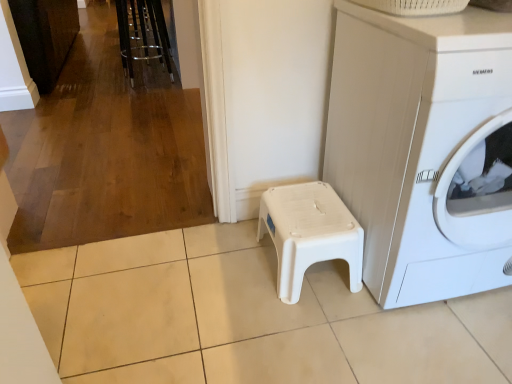
Question: In the image, is white plastic washing machine at lower right on the left side or the right side of white plastic stool at center?

Choices:
 (A) right
 (B) left

Answer: (A)

Question: Do you think white plastic washing machine at lower right is within white plastic stool at center, or outside of it?

Choices:
 (A) outside
 (B) inside

Answer: (A)

Question: Which object is the farthest from the metallic chrome bar stool at upper left?

Choices:
 (A) white plastic stool at center
 (B) white plastic washing machine at lower right

Answer: (B)

Question: Estimate the real-world distances between objects in this image. Which object is closer to the metallic chrome bar stool at upper left?

Choices:
 (A) white plastic washing machine at lower right
 (B) white plastic stool at center

Answer: (B)